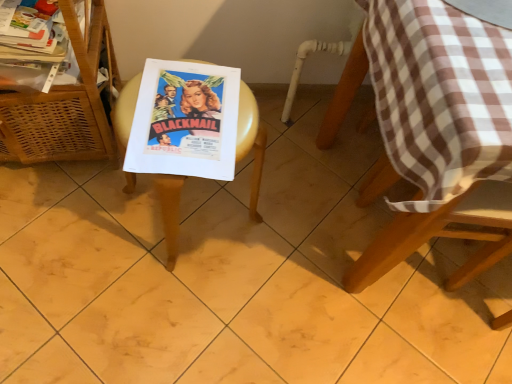
Identify the location of free space in front of woven wood basket at left. (55, 241).